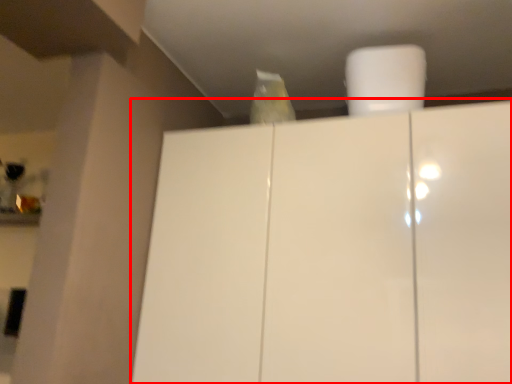
Question: Considering the relative positions of cupboard (annotated by the red box) and paper towel in the image provided, where is cupboard (annotated by the red box) located with respect to the staircase?

Choices:
 (A) left
 (B) right

Answer: (A)